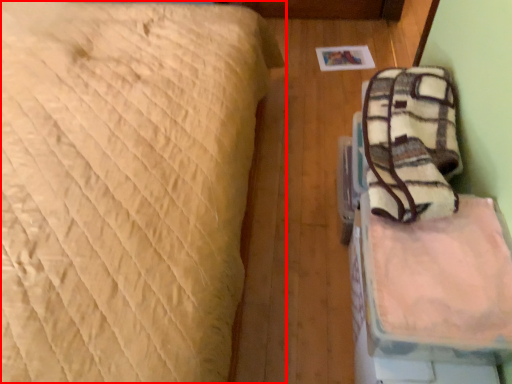
Question: In this image, where is bed (annotated by the red box) located relative to sheet?

Choices:
 (A) left
 (B) right

Answer: (A)